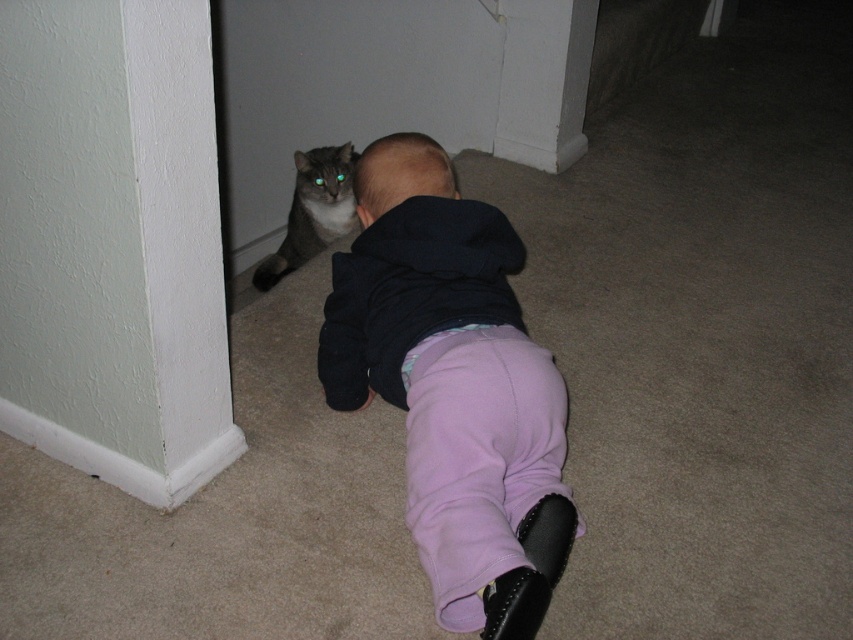
You are a photographer trying to capture a closeup of the gray fur cat at left and the smooth black hair at center. Since the cat is blocking the hair, can you adjust your angle to focus on the hair without moving the cat?

The gray fur cat at left is positioned over smooth black hair at center, so you cannot focus on the smooth black hair at center without moving the cat because it is completely blocked by the cat.

You are a photographer trying to capture a closeup of the gray fur cat at left while ensuring the purple fleece pants at center is still visible in the frame. Can you fit both in the shot without zooming in too much?

The purple fleece pants at center is larger in size than gray fur cat at left, so you can fit both in the shot without zooming in too much as the purple fleece pants at center takes up more space but the gray fur cat at left is smaller and can be included alongside.